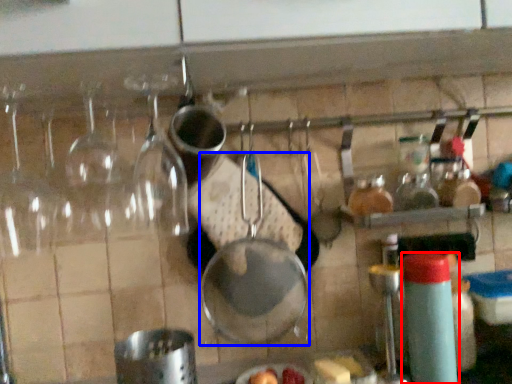
Question: Which point is closer to the camera, bottle (highlighted by a red box) or frying pan (highlighted by a blue box)?

Choices:
 (A) bottle
 (B) frying pan

Answer: (A)